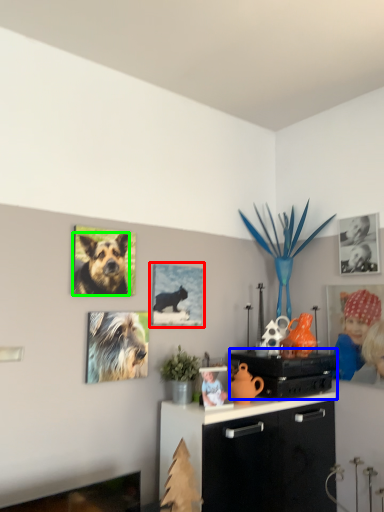
Question: Which object is the closest to the picture frame (highlighted by a red box)? Choose among these: appliance (highlighted by a blue box) or dog (highlighted by a green box).

Choices:
 (A) appliance
 (B) dog

Answer: (B)